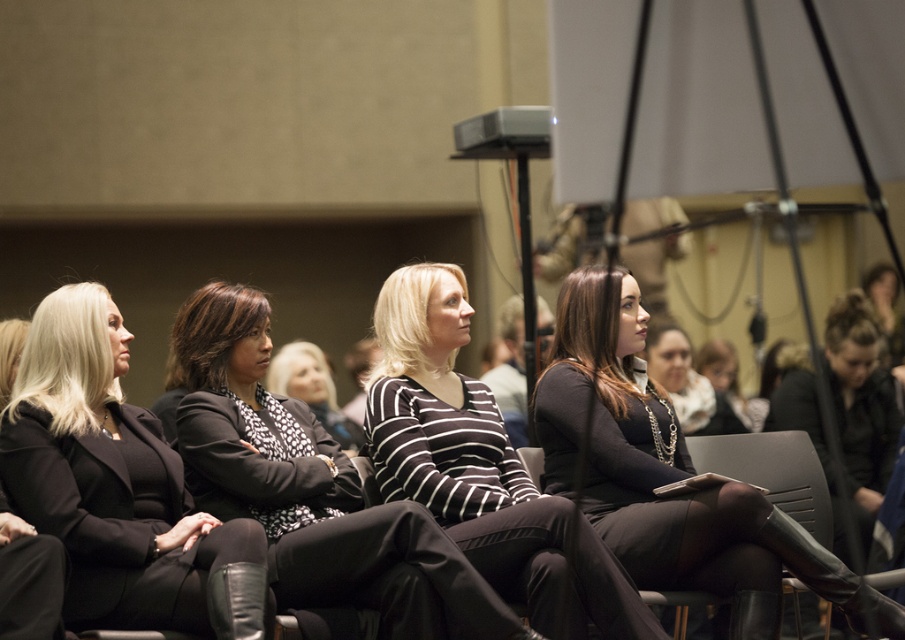
Question: Where is matte black blazer at center located in relation to matte black dress at center in the image?

Choices:
 (A) above
 (B) below

Answer: (A)

Question: Which of the following is the closest to the observer?

Choices:
 (A) (255, 513)
 (B) (312, 371)

Answer: (A)

Question: Which of the following is the farthest from the observer?

Choices:
 (A) striped fabric sweater at center
 (B) black textured blazer at center
 (C) black striped sweater at center
 (D) matte black dress at center

Answer: (A)

Question: Estimate the real-world distances between objects in this image. Which object is closer to the matte black dress at center?

Choices:
 (A) black textured blazer at center
 (B) black striped sweater at center

Answer: (B)

Question: Does black textured blazer at center have a lesser width compared to striped fabric sweater at center?

Choices:
 (A) yes
 (B) no

Answer: (B)

Question: Does matte black dress at center appear on the left side of striped fabric sweater at center?

Choices:
 (A) no
 (B) yes

Answer: (A)